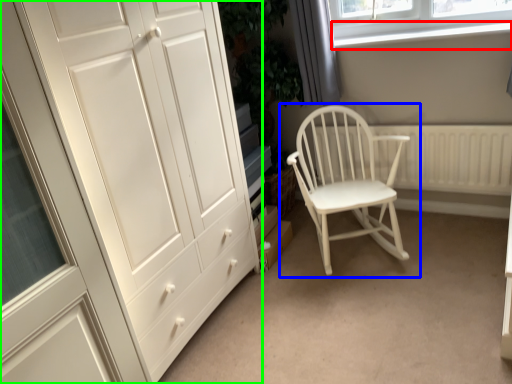
Question: Based on their relative distances, which object is nearer to window sill (highlighted by a red box)? Choose from chair (highlighted by a blue box) and cupboard (highlighted by a green box).

Choices:
 (A) chair
 (B) cupboard

Answer: (A)